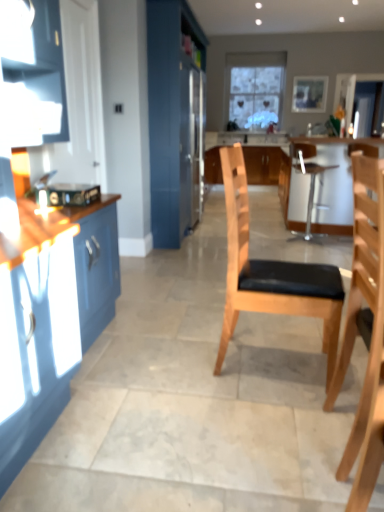
Question: Considering the relative positions of satin silver refrigerator at center and wooden picture frame at upper center in the image provided, is satin silver refrigerator at center behind wooden picture frame at upper center?

Choices:
 (A) yes
 (B) no

Answer: (B)

Question: Can you confirm if satin silver refrigerator at center is shorter than wooden picture frame at upper center?

Choices:
 (A) no
 (B) yes

Answer: (A)

Question: Is satin silver refrigerator at center turned away from wooden picture frame at upper center?

Choices:
 (A) yes
 (B) no

Answer: (B)

Question: Is satin silver refrigerator at center at the left side of wooden picture frame at upper center?

Choices:
 (A) yes
 (B) no

Answer: (A)

Question: Considering the relative sizes of satin silver refrigerator at center and wooden picture frame at upper center in the image provided, is satin silver refrigerator at center smaller than wooden picture frame at upper center?

Choices:
 (A) no
 (B) yes

Answer: (A)

Question: Does satin silver refrigerator at center have a greater width compared to wooden picture frame at upper center?

Choices:
 (A) yes
 (B) no

Answer: (A)

Question: Considering the relative sizes of wooden picture frame at upper center and natural wood chair at center, which appears as the 3th chair when viewed from the back, in the image provided, is wooden picture frame at upper center taller than natural wood chair at center, which appears as the 3th chair when viewed from the back,?

Choices:
 (A) no
 (B) yes

Answer: (A)

Question: From the image's perspective, does wooden picture frame at upper center appear lower than natural wood chair at center, placed as the second chair when sorted from left to right?

Choices:
 (A) no
 (B) yes

Answer: (A)

Question: From the image's perspective, would you say wooden picture frame at upper center is positioned over natural wood chair at center, the second chair in the right-to-left sequence?

Choices:
 (A) no
 (B) yes

Answer: (B)

Question: Can natural wood chair at center, marked as the first chair in a front-to-back arrangement, be found inside wooden picture frame at upper center?

Choices:
 (A) no
 (B) yes

Answer: (A)

Question: Considering the relative positions of wooden picture frame at upper center and natural wood chair at center, which appears as the 3th chair when viewed from the back, in the image provided, is wooden picture frame at upper center to the left of natural wood chair at center, which appears as the 3th chair when viewed from the back, from the viewer's perspective?

Choices:
 (A) yes
 (B) no

Answer: (B)

Question: Can you confirm if wooden picture frame at upper center is shorter than natural wood chair at center, which appears as the 3th chair when viewed from the back?

Choices:
 (A) yes
 (B) no

Answer: (A)

Question: Are wooden picture frame at upper center and satin silver refrigerator at center making contact?

Choices:
 (A) no
 (B) yes

Answer: (A)